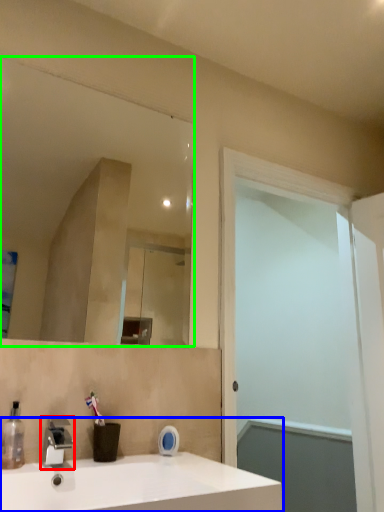
Question: Estimate the real-world distances between objects in this image. Which object is farther from tap (highlighted by a red box), sink (highlighted by a blue box) or mirror (highlighted by a green box)?

Choices:
 (A) sink
 (B) mirror

Answer: (B)